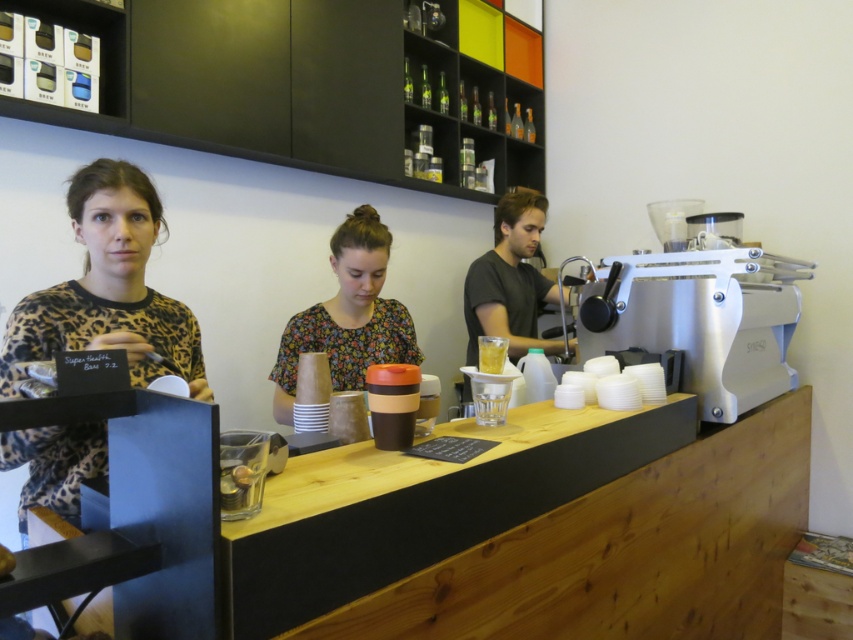
Question: Is floral fabric shirt at center above translucent plastic cup at center?

Choices:
 (A) no
 (B) yes

Answer: (B)

Question: Is floral fabric shirt at center to the right of translucent plastic cup at center from the viewer's perspective?

Choices:
 (A) no
 (B) yes

Answer: (A)

Question: In this image, where is floral fabric shirt at center located relative to translucent plastic cup at center?

Choices:
 (A) below
 (B) above

Answer: (B)